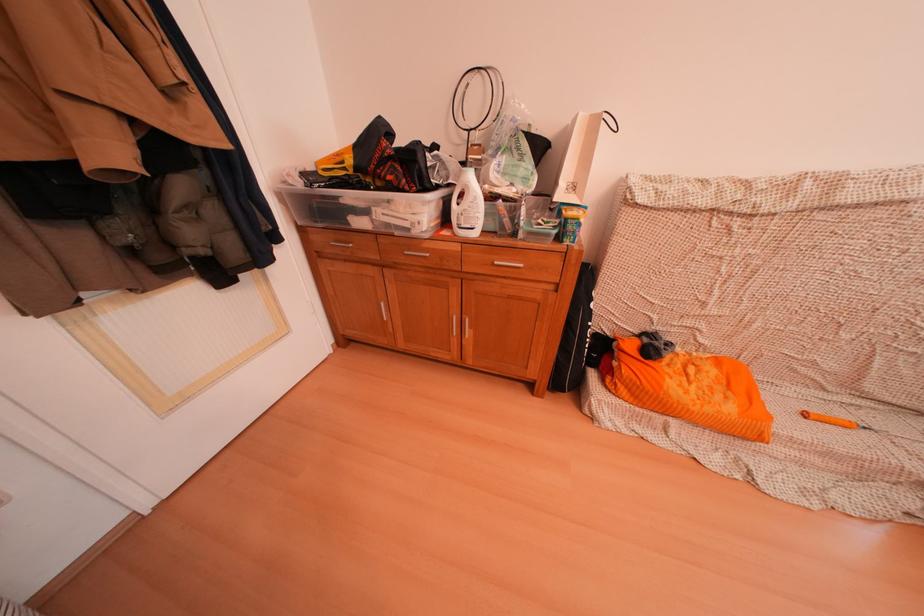
Image resolution: width=924 pixels, height=616 pixels. What do you see at coordinates (733, 378) in the screenshot?
I see `a sofa sitting surface` at bounding box center [733, 378].